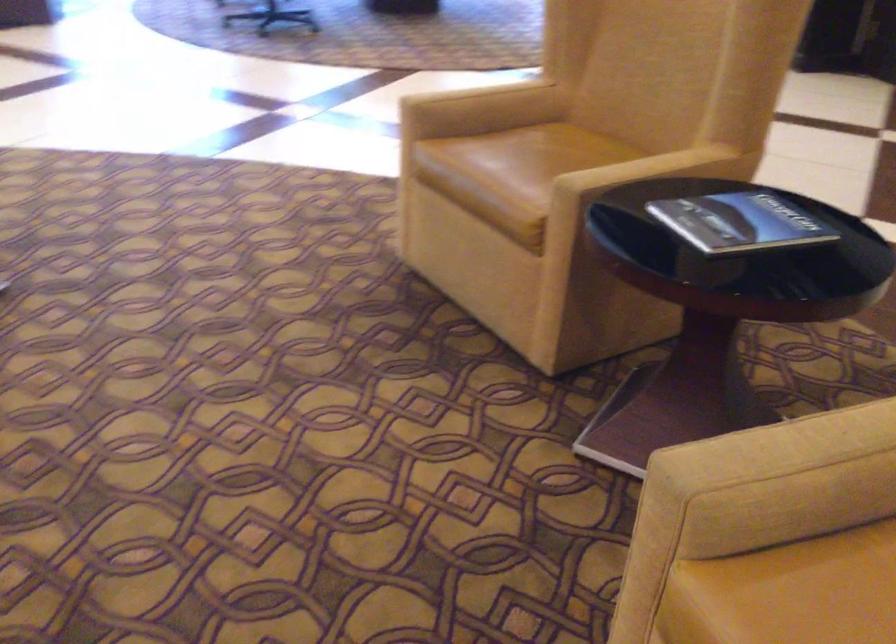
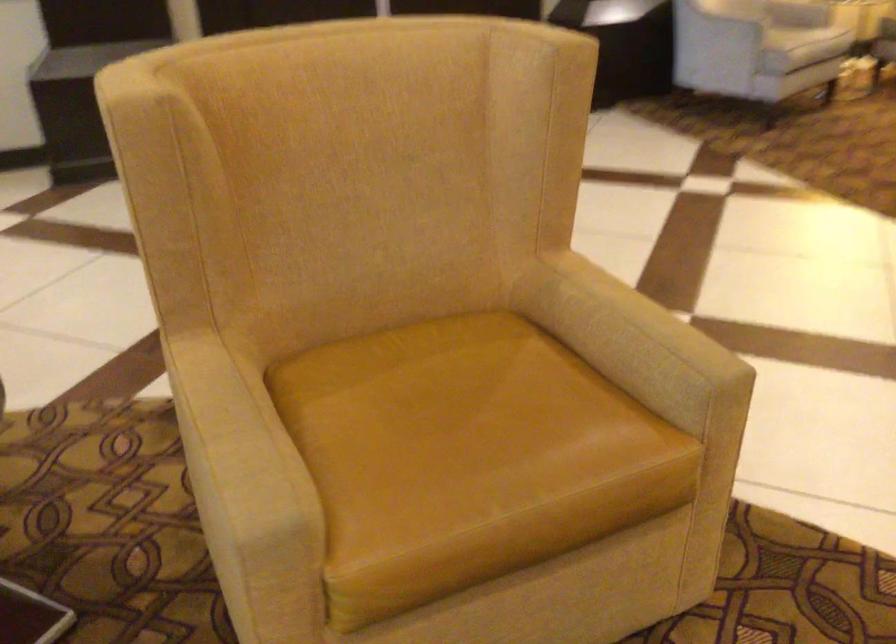
The first image is from the beginning of the video and the second image is from the end. How did the camera likely rotate when shooting the video?

The rotation direction of the camera is right-down.